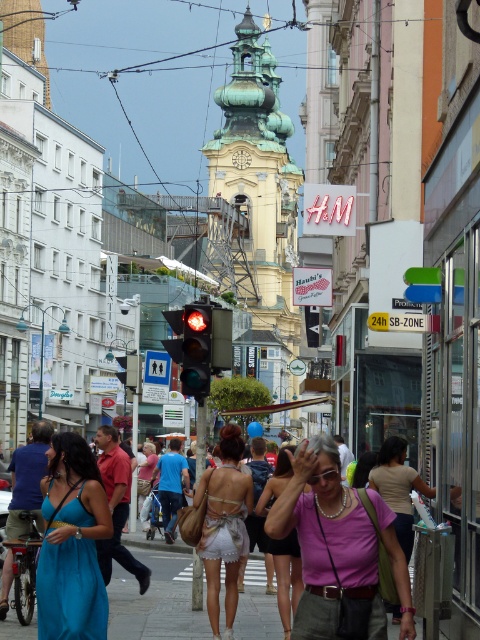
You are standing at the center of the image and want to find the matte white dress at center. In which direction should you look to see it?

The matte white dress at center is located at point coordinates of 0.900 on the x axis and 0.598 on the y axis. Since the center of the image is at coordinates (240, 320), you should look to the right and slightly downward to find the matte white dress at center.

You are a photographer trying to capture a photo of the historic church tower in the background. You notice two people in the foreground wearing a red shirt at center and a white lace dress at center. Which person should you focus on to ensure the church tower remains in the background without being blocked?

You should focus on the red shirt at center because it is positioned on the left side of the white lace dress at center, so it is further away from the center and less likely to block the church tower in the background.